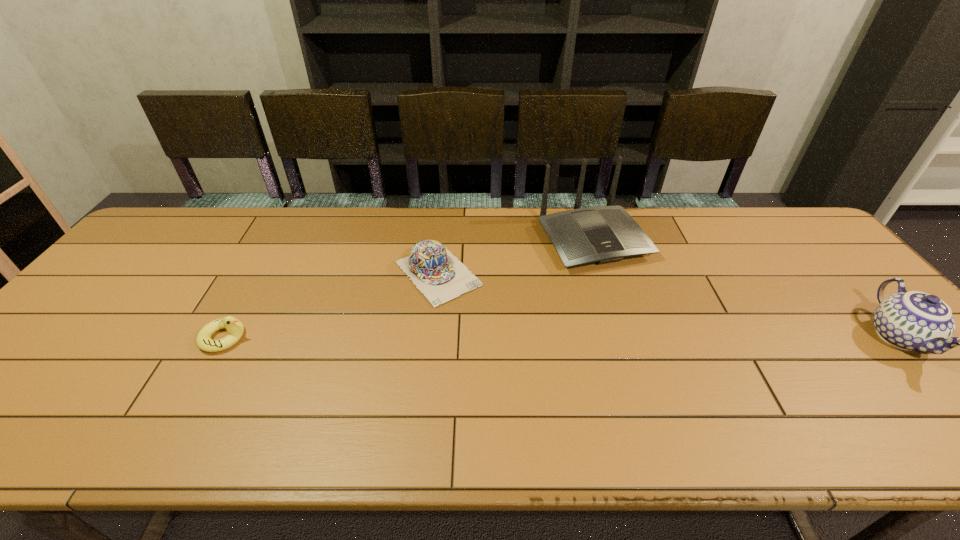
Locate an element on the screen. The image size is (960, 540). vacant spot on the desktop that is between the leftmost object and the chinaware and is positioned on the front, side, and top of the cap is located at coordinates (497, 338).

Locate an element on the screen. vacant space on the desktop that is between the duckling and the chinaware and is positioned on the front-facing side of the second object from right to left is located at coordinates (661, 337).